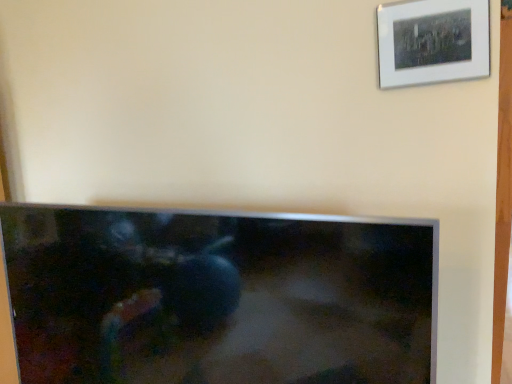
Question: From the image's perspective, is matte black tv at center located above white matte picture frame at upper right?

Choices:
 (A) no
 (B) yes

Answer: (A)

Question: Are matte black tv at center and white matte picture frame at upper right far apart?

Choices:
 (A) yes
 (B) no

Answer: (B)

Question: Is white matte picture frame at upper right surrounded by matte black tv at center?

Choices:
 (A) no
 (B) yes

Answer: (A)

Question: From a real-world perspective, is matte black tv at center physically below white matte picture frame at upper right?

Choices:
 (A) yes
 (B) no

Answer: (A)

Question: Is matte black tv at center in front of white matte picture frame at upper right?

Choices:
 (A) yes
 (B) no

Answer: (A)

Question: Is matte black tv at center shorter than white matte picture frame at upper right?

Choices:
 (A) no
 (B) yes

Answer: (A)

Question: Is white matte picture frame at upper right positioned with its back to matte black tv at center?

Choices:
 (A) no
 (B) yes

Answer: (A)

Question: Is white matte picture frame at upper right further to the viewer compared to matte black tv at center?

Choices:
 (A) yes
 (B) no

Answer: (A)

Question: Can you see white matte picture frame at upper right touching matte black tv at center?

Choices:
 (A) no
 (B) yes

Answer: (A)

Question: Is the position of white matte picture frame at upper right less distant than that of matte black tv at center?

Choices:
 (A) yes
 (B) no

Answer: (B)

Question: Does white matte picture frame at upper right have a greater width compared to matte black tv at center?

Choices:
 (A) no
 (B) yes

Answer: (A)

Question: Considering the relative sizes of white matte picture frame at upper right and matte black tv at center in the image provided, is white matte picture frame at upper right taller than matte black tv at center?

Choices:
 (A) yes
 (B) no

Answer: (B)

Question: From a real-world perspective, is white matte picture frame at upper right physically located above or below matte black tv at center?

Choices:
 (A) below
 (B) above

Answer: (B)